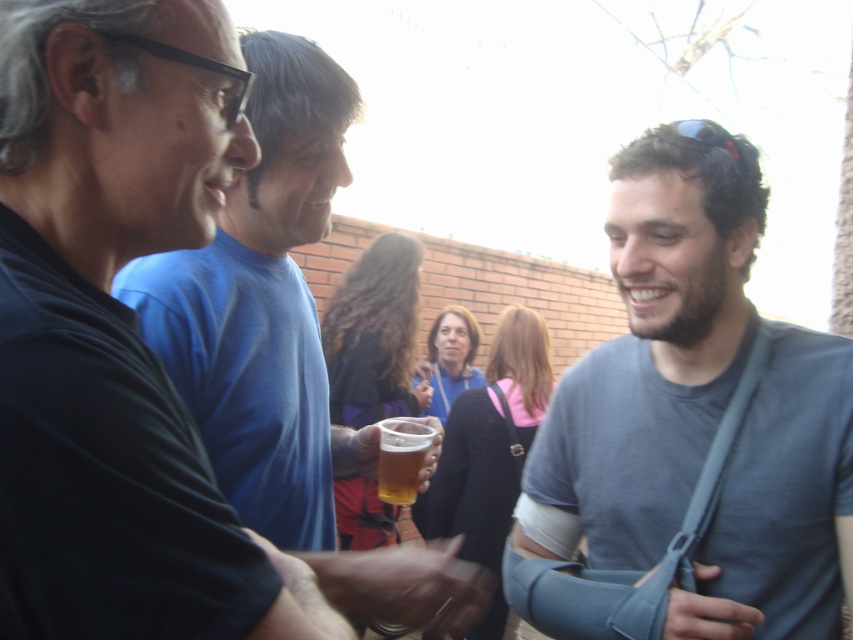
Question: From the image, what is the correct spatial relationship of gray fabric arm sling at center in relation to translucent glass beer at center?

Choices:
 (A) below
 (B) above

Answer: (B)

Question: Can you confirm if gray fabric arm sling at center is positioned to the right of blue smooth t-shirt at center?

Choices:
 (A) no
 (B) yes

Answer: (B)

Question: Which object is closer to the camera taking this photo?

Choices:
 (A) blue smooth t-shirt at center
 (B) black matte t-shirt at left
 (C) gray fabric arm sling at center

Answer: (B)

Question: Which object is closer to the camera taking this photo?

Choices:
 (A) translucent glass beer at center
 (B) gray fabric arm sling at center
 (C) blue smooth t-shirt at center
 (D) black matte t-shirt at left

Answer: (D)

Question: Does gray fabric arm sling at center have a larger size compared to translucent glass beer at center?

Choices:
 (A) yes
 (B) no

Answer: (A)

Question: Which of the following is the closest to the observer?

Choices:
 (A) black matte t-shirt at left
 (B) gray fabric arm sling at center
 (C) translucent glass beer at center
 (D) blue smooth t-shirt at center

Answer: (A)